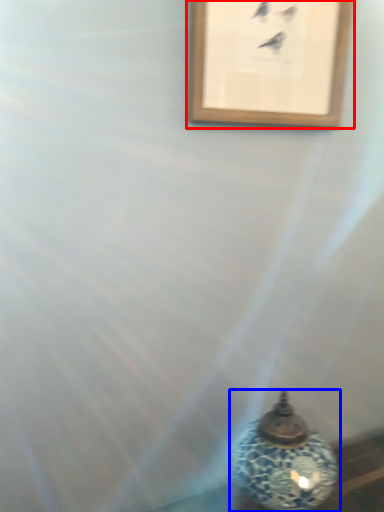
Question: Which of the following is the closest to the observer, picture frame (highlighted by a red box) or oil lamp (highlighted by a blue box)?

Choices:
 (A) picture frame
 (B) oil lamp

Answer: (B)